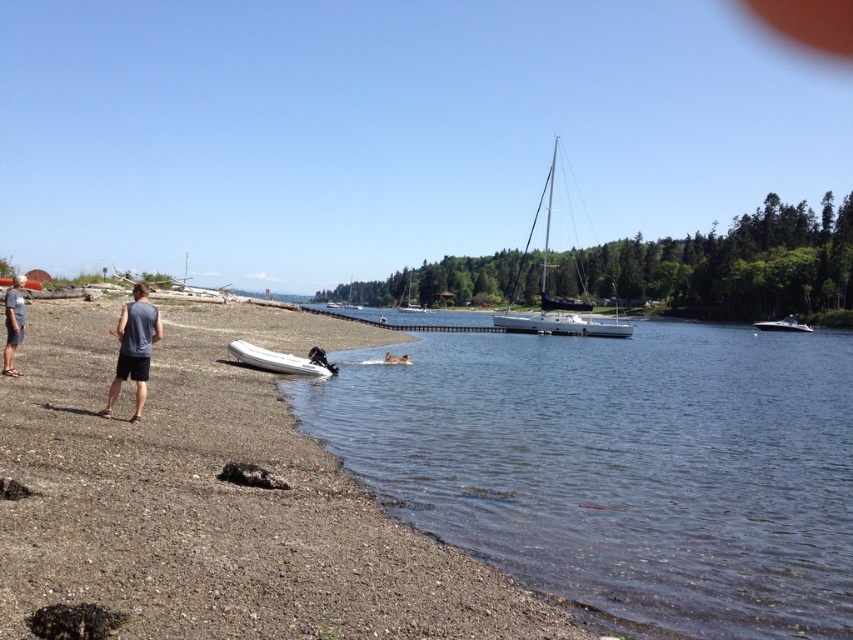
Does white matte sailboat at center appear on the left side of brown leather dog at lower center?

Yes, white matte sailboat at center is to the left of brown leather dog at lower center.

Is point (421, 305) positioned behind point (393, 356)?

Yes, it is behind point (393, 356).

The height and width of the screenshot is (640, 853). Find the location of `white matte sailboat at center`. white matte sailboat at center is located at coordinates (410, 301).

Find the location of a particular element. Image resolution: width=853 pixels, height=640 pixels. white matte sailboat at center is located at coordinates (410, 301).

Does clear water at lower center come behind white plastic canoe at lower left?

That is False.

Between clear water at lower center and white plastic canoe at lower left, which one appears on the left side from the viewer's perspective?

Positioned to the left is white plastic canoe at lower left.

Describe the element at coordinates (619, 465) in the screenshot. I see `clear water at lower center` at that location.

You are a GUI agent. You are given a task and a screenshot of the screen. Output one action in this format:
    pyautogui.click(x=<x>, y=<y>)
    Task: Click on the clear water at lower center
    This screenshot has height=640, width=853.
    Given the screenshot: What is the action you would take?
    pyautogui.click(x=619, y=465)

Does clear water at lower center have a larger size compared to gray sleeveless shirt at left?

Indeed, clear water at lower center has a larger size compared to gray sleeveless shirt at left.

Is point (756, 380) farther from camera compared to point (160, 332)?

Yes.

The width and height of the screenshot is (853, 640). Find the location of `clear water at lower center`. clear water at lower center is located at coordinates (619, 465).